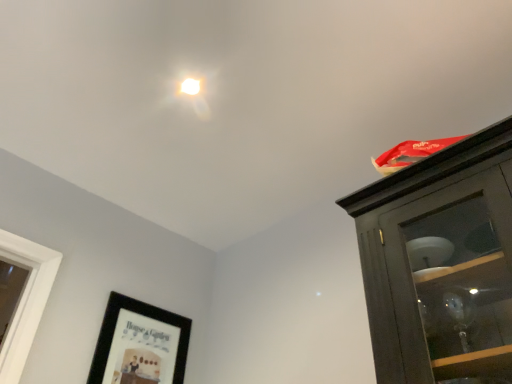
Describe the element at coordinates (140, 344) in the screenshot. The height and width of the screenshot is (384, 512). I see `black matte picture frame at lower left` at that location.

I want to click on black matte picture frame at lower left, so [140, 344].

Locate an element on the screen. This screenshot has height=384, width=512. black matte picture frame at lower left is located at coordinates (140, 344).